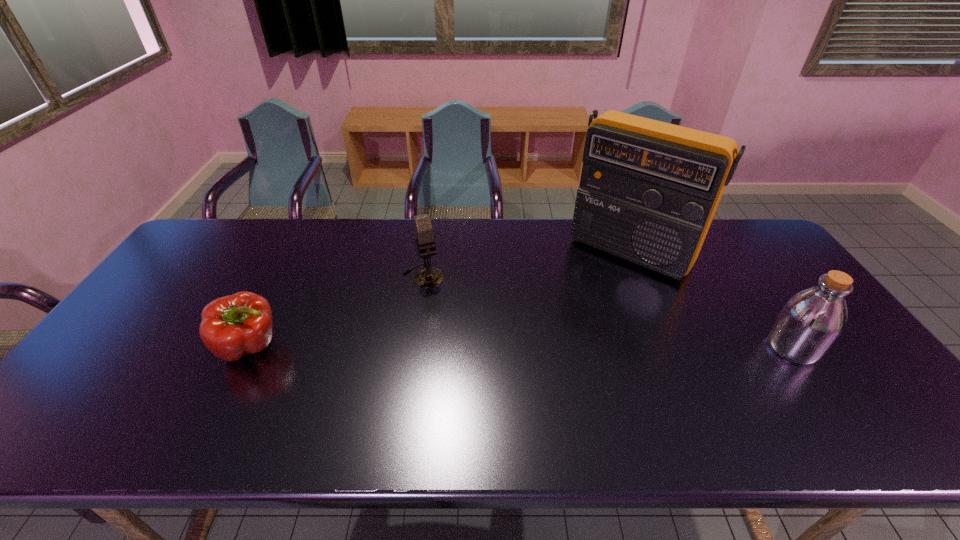
Locate an element on the screen. vacant space on the desktop that is between the pepper and the rightmost object and is positioned on the front-facing side of the third object from right to left is located at coordinates (455, 347).

Where is `vacant space on the desktop that is between the leftmost object and the bottle and is positioned on the front-facing side of the tallest object`? The height and width of the screenshot is (540, 960). vacant space on the desktop that is between the leftmost object and the bottle and is positioned on the front-facing side of the tallest object is located at coordinates (554, 347).